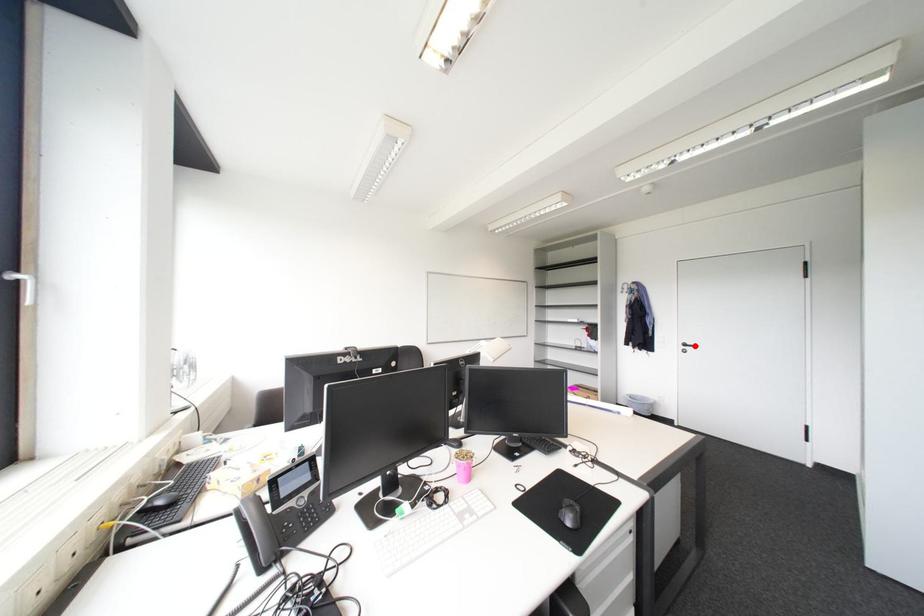
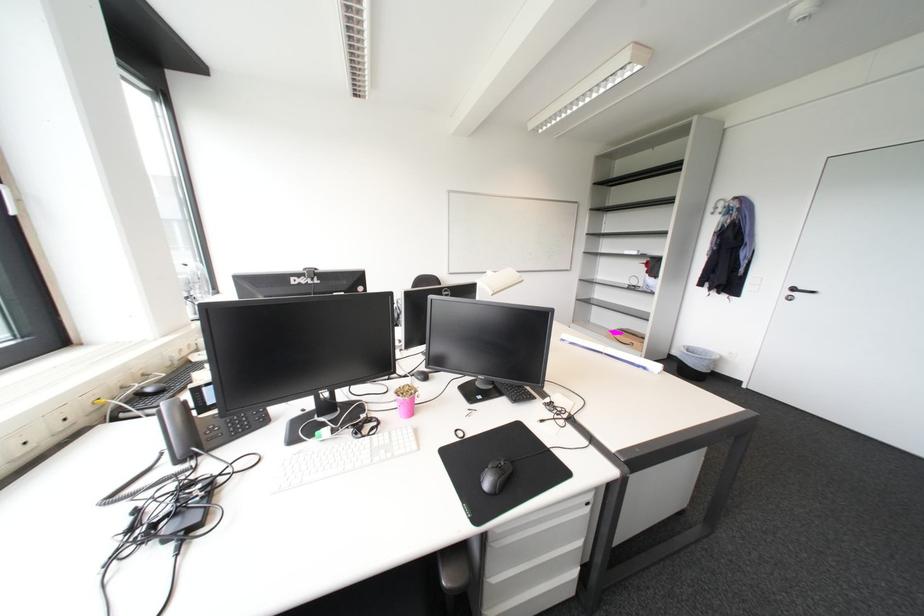
Where in the second image is the point corresponding to the highlighted location from the first image?

(805, 291)